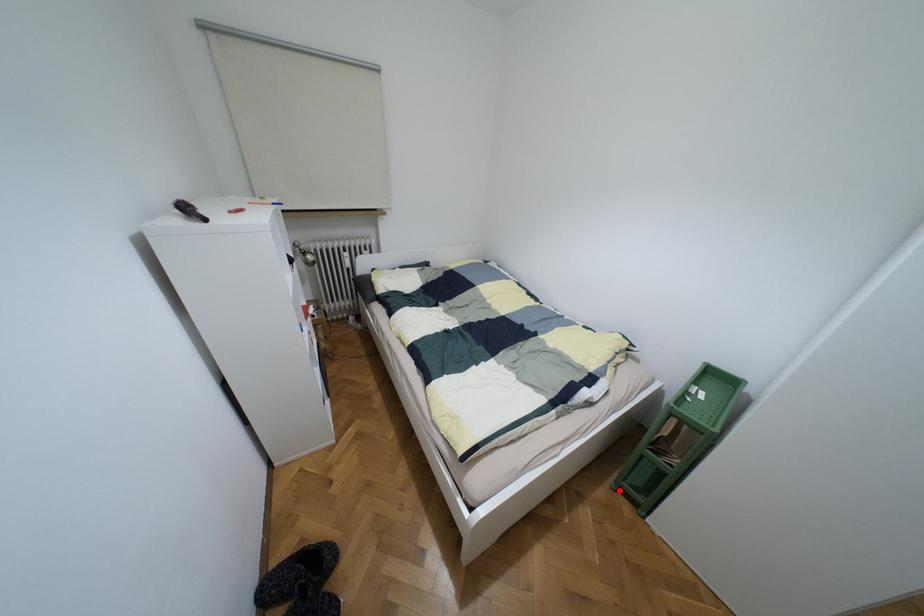
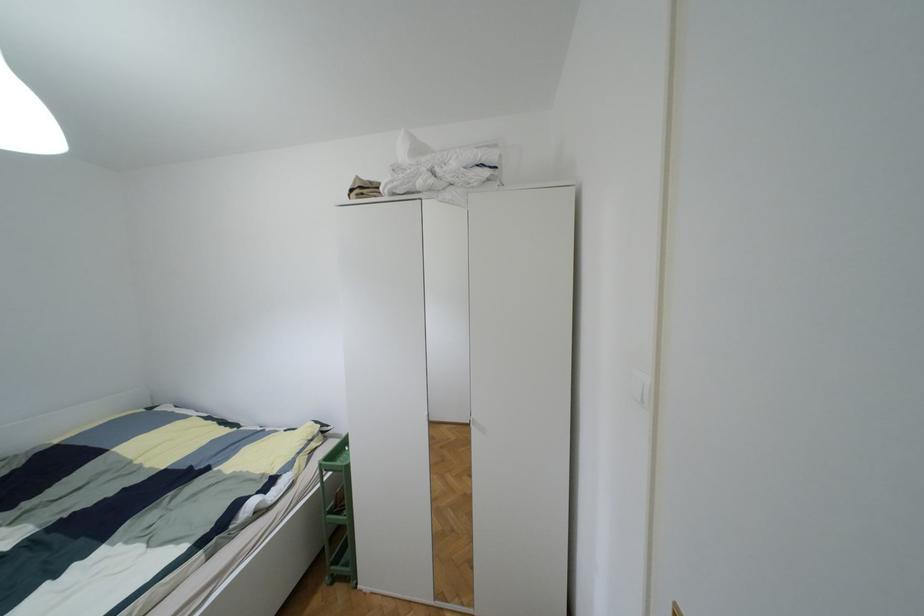
Find the pixel in the second image that matches the highlighted location in the first image.

(333, 578)